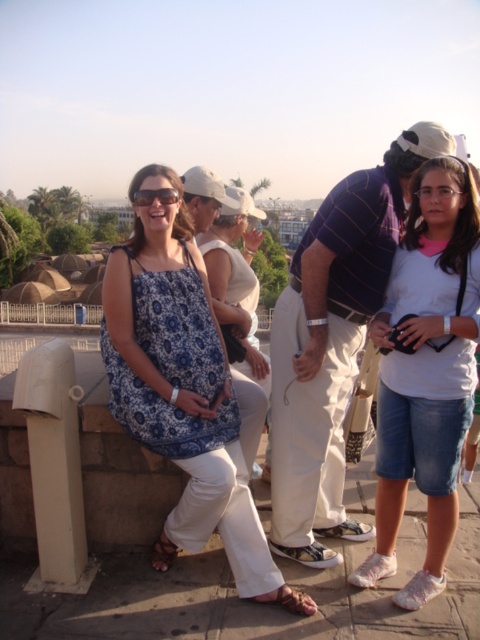
Who is lower down, striped cotton shirt at center or matte black sunglasses at center?

matte black sunglasses at center is lower down.

Where is `striped cotton shirt at center`? This screenshot has height=640, width=480. striped cotton shirt at center is located at coordinates (333, 342).

Is white cotton shirt at center below matte black sunglasses at center?

Correct, white cotton shirt at center is located below matte black sunglasses at center.

Does white cotton shirt at center have a lesser width compared to matte black sunglasses at center?

Incorrect, white cotton shirt at center's width is not less than matte black sunglasses at center's.

Between point (420, 456) and point (168, 193), which one is positioned behind?

The point (168, 193) is behind.

The image size is (480, 640). Identify the location of white cotton shirt at center. (425, 372).

Describe the element at coordinates (333, 342) in the screenshot. This screenshot has width=480, height=640. I see `striped cotton shirt at center` at that location.

Locate an element on the screen. The image size is (480, 640). striped cotton shirt at center is located at coordinates (333, 342).